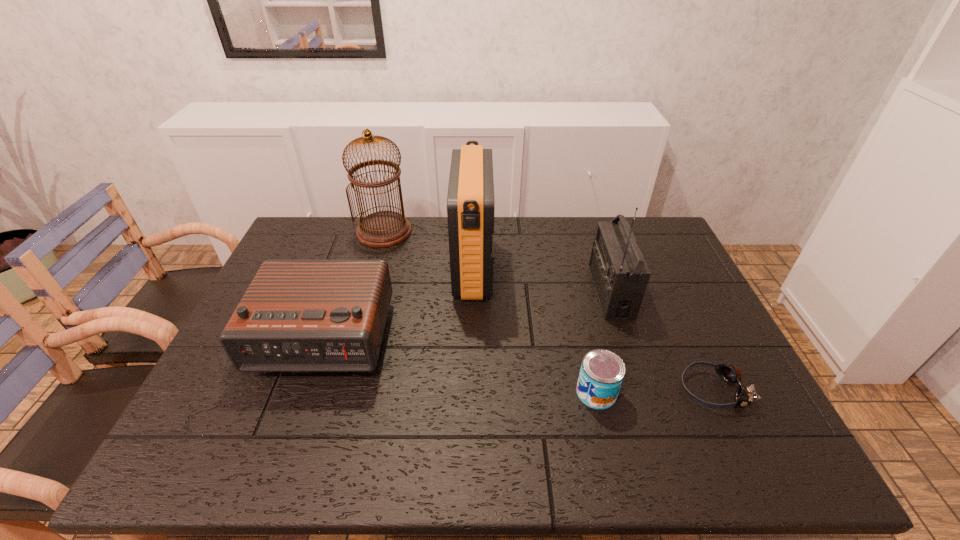
Identify the location of birdcage. (382, 229).

Where is `the rightmost radio receiver`? The height and width of the screenshot is (540, 960). the rightmost radio receiver is located at coordinates (619, 271).

Find the location of a particular element. Image resolution: width=960 pixels, height=540 pixels. the second radio receiver from right to left is located at coordinates (470, 201).

I want to click on the leftmost radio receiver, so click(x=297, y=315).

You are a GUI agent. You are given a task and a screenshot of the screen. Output one action in this format:
    pyautogui.click(x=<x>, y=<y>)
    Task: Click on the shortest radio receiver
    
    Given the screenshot: What is the action you would take?
    pyautogui.click(x=297, y=315)

Identify the location of the third object from right to left. (602, 372).

The width and height of the screenshot is (960, 540). I want to click on the fifth tallest object, so click(602, 372).

Identify the location of the shortest object. Image resolution: width=960 pixels, height=540 pixels. (731, 374).

This screenshot has width=960, height=540. In order to click on goggles in this screenshot , I will do `click(731, 374)`.

Locate an element on the screen. Image resolution: width=960 pixels, height=540 pixels. vacant region located 0.370m on the front-facing side of the birdcage is located at coordinates (356, 330).